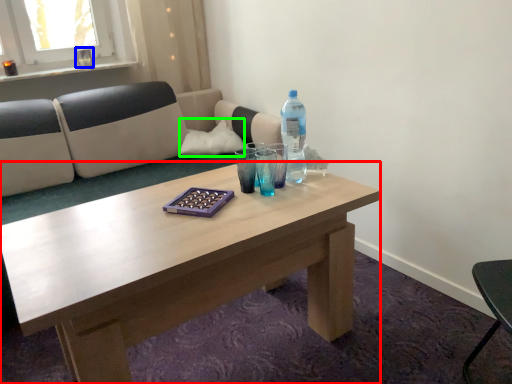
Question: Which object is the closest to the coffee table (highlighted by a red box)? Choose among these: glass vase (highlighted by a blue box) or pillow (highlighted by a green box).

Choices:
 (A) glass vase
 (B) pillow

Answer: (B)